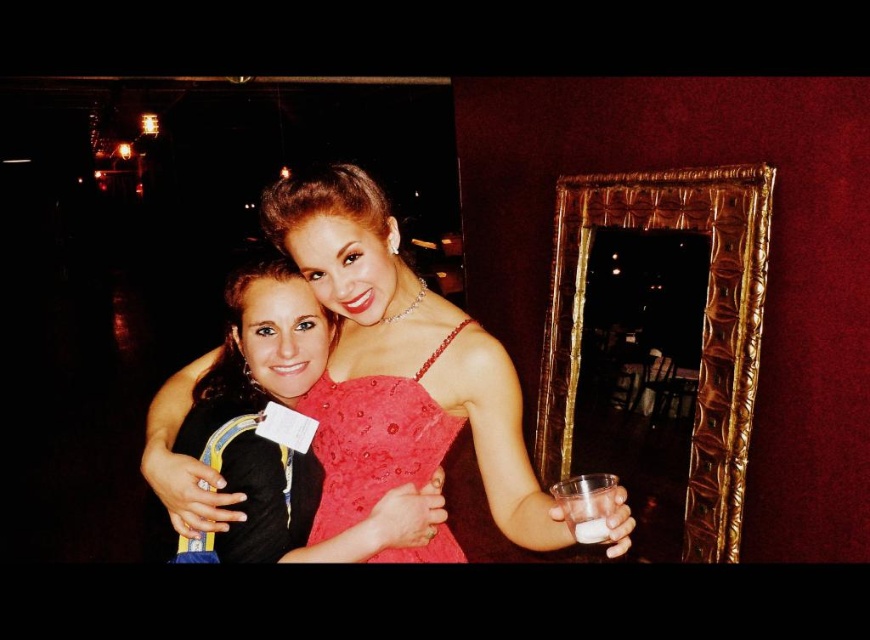
Question: Is shiny satin dress at center further to the viewer compared to translucent glass cup at center?

Choices:
 (A) yes
 (B) no

Answer: (A)

Question: Among these points, which one is farthest from the camera?

Choices:
 (A) (566, 488)
 (B) (586, 529)
 (C) (396, 420)
 (D) (417, 474)

Answer: (D)

Question: Which point is farther to the camera?

Choices:
 (A) matte red dress at center
 (B) shiny satin dress at center
 (C) translucent glass cup at center

Answer: (B)

Question: Can you confirm if matte red dress at center is positioned to the left of shiny satin dress at center?

Choices:
 (A) yes
 (B) no

Answer: (B)

Question: Which object is positioned farthest from the shiny satin dress at center?

Choices:
 (A) matte red dress at center
 (B) clear plastic cup at right
 (C) translucent glass cup at center

Answer: (C)

Question: Can you confirm if clear plastic cup at right is positioned to the right of translucent glass cup at center?

Choices:
 (A) yes
 (B) no

Answer: (A)